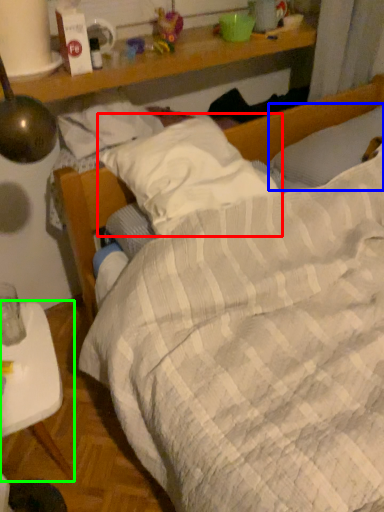
Question: Estimate the real-world distances between objects in this image. Which object is farther from pillow (highlighted by a red box), pillow (highlighted by a blue box) or desk (highlighted by a green box)?

Choices:
 (A) pillow
 (B) desk

Answer: (B)